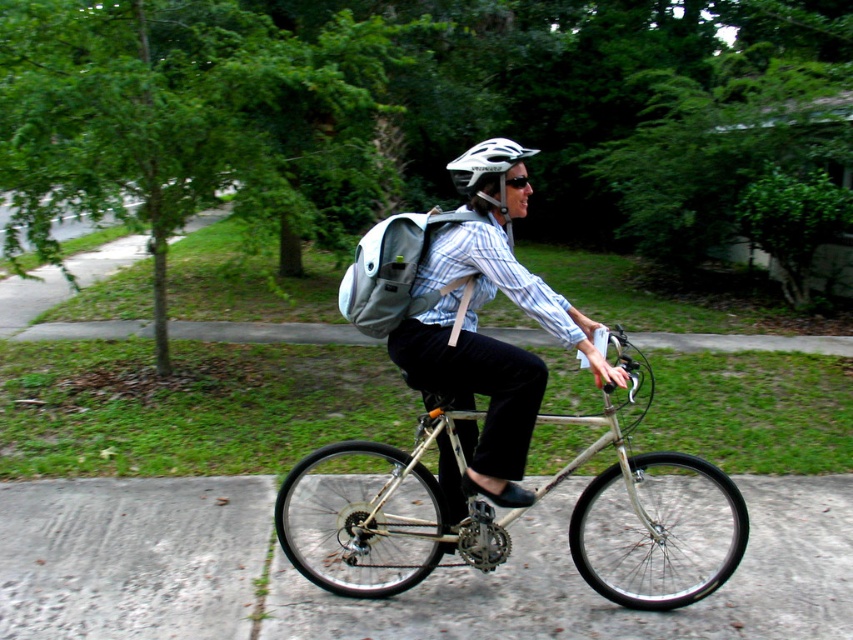
You are a delivery person who needs to attach a small package to your bicycle. You have a silver metallic bicycle at center and a matte gray backpack at center. Which object should you attach the package to if you want it to be closer to the right side of your backpack?

The silver metallic bicycle at center is positioned on the right side of matte gray backpack at center, so attaching the package to the bicycle would place it closer to the right side of the backpack.

You are a delivery person who needs to secure a package on your silver metallic bicycle at center. However, you also have a white matte bicycle helmet at center that you must wear. Based on the scene, where should you position the package relative to the helmet?

The silver metallic bicycle at center is located below the white matte bicycle helmet at center, so you should place the package below the helmet to ensure it stays secure on the bicycle.